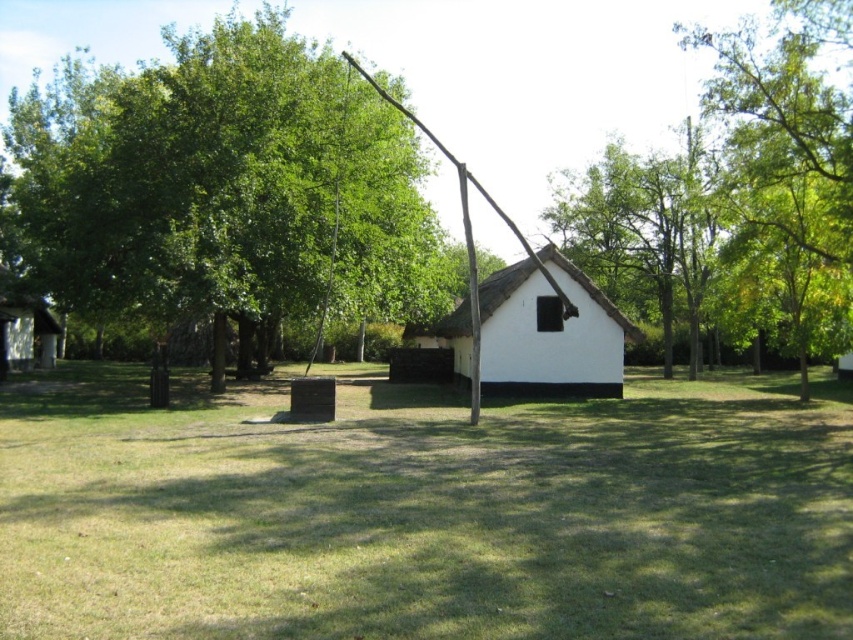
You are planning to build a small garden between the green leafy tree at upper right and the wooden hut at lower left. Based on the scene, which object has a larger width to accommodate more plants?

The green leafy tree at upper right might be wider than the wooden hut at lower left, so it could provide more space for the garden.